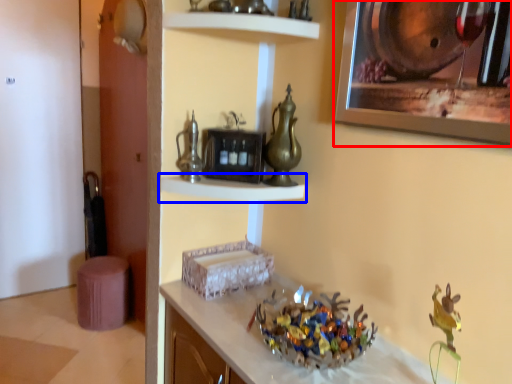
Question: Among these objects, which one is nearest to the camera, picture frame (highlighted by a red box) or shelf (highlighted by a blue box)?

Choices:
 (A) picture frame
 (B) shelf

Answer: (A)